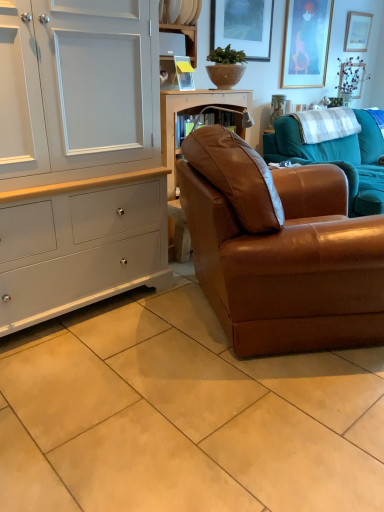
Locate an element on the screen. The width and height of the screenshot is (384, 512). free space in front of white painted wood cabinet at left is located at coordinates (99, 378).